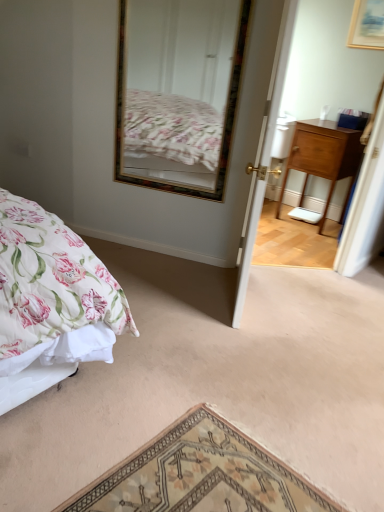
The width and height of the screenshot is (384, 512). What do you see at coordinates (264, 156) in the screenshot?
I see `white wooden door at center` at bounding box center [264, 156].

Image resolution: width=384 pixels, height=512 pixels. I want to click on white wooden door at center, so click(264, 156).

What is the approximate height of wooden-framed mirror at upper center?

It is 1.09 meters.

Locate an element on the screen. The height and width of the screenshot is (512, 384). wooden picture frame at upper right is located at coordinates (367, 25).

Find the location of a particular element. The height and width of the screenshot is (512, 384). white wooden door at center is located at coordinates (264, 156).

Who is taller, wooden nightstand at right or wooden-framed mirror at upper center?

wooden-framed mirror at upper center is taller.

Is point (349, 187) positioned behind point (180, 70)?

Yes, it is behind point (180, 70).

Is wooden nightstand at right wider or thinner than wooden-framed mirror at upper center?

wooden nightstand at right is wider than wooden-framed mirror at upper center.

From a real-world perspective, which is physically above, wooden nightstand at right or wooden-framed mirror at upper center?

From a 3D spatial view, wooden-framed mirror at upper center is above.

Which is closer to the camera, (360, 6) or (218, 78)?

Point (360, 6) is farther from the camera than point (218, 78).

From the picture: From the image's perspective, is wooden picture frame at upper right above or below wooden-framed mirror at upper center?

wooden picture frame at upper right is situated higher than wooden-framed mirror at upper center in the image.

How different are the orientations of wooden picture frame at upper right and wooden-framed mirror at upper center in degrees?

The angle between the facing direction of wooden picture frame at upper right and the facing direction of wooden-framed mirror at upper center is 26.6 degrees.

You are a GUI agent. You are given a task and a screenshot of the screen. Output one action in this format:
    pyautogui.click(x=<x>, y=<y>)
    Task: Click on the mirror that appears below the wooden picture frame at upper right (from the image's perspective)
    Image resolution: width=384 pixels, height=512 pixels.
    Given the screenshot: What is the action you would take?
    pyautogui.click(x=178, y=92)

From the image's perspective, which is above, wooden-framed mirror at upper center or wooden nightstand at right?

wooden-framed mirror at upper center, from the image's perspective.

Is there a large distance between wooden-framed mirror at upper center and wooden nightstand at right?

Actually, wooden-framed mirror at upper center and wooden nightstand at right are a little close together.

Between wooden-framed mirror at upper center and wooden nightstand at right, which one has less height?

With less height is wooden nightstand at right.

From a real-world perspective, is wooden-framed mirror at upper center physically located above or below white wooden door at center?

wooden-framed mirror at upper center is situated higher than white wooden door at center in the real world.

Is wooden-framed mirror at upper center facing away from white wooden door at center?

No.

From the image's perspective, does wooden-framed mirror at upper center appear lower than white wooden door at center?

Actually, wooden-framed mirror at upper center appears above white wooden door at center in the image.

Is wooden-framed mirror at upper center not near white wooden door at center?

Yes, wooden-framed mirror at upper center is far from white wooden door at center.

Is wooden picture frame at upper right at the left side of wooden nightstand at right?

No, wooden picture frame at upper right is not to the left of wooden nightstand at right.

Is wooden picture frame at upper right placed right next to wooden nightstand at right?

wooden picture frame at upper right and wooden nightstand at right are not in contact.

Identify the location of nightstand below the wooden picture frame at upper right (from a real-world perspective). The width and height of the screenshot is (384, 512). (323, 159).

Is white wooden door at center positioned behind wooden-framed mirror at upper center?

No, it is in front of wooden-framed mirror at upper center.

Is wooden-framed mirror at upper center at the back of white wooden door at center?

Absolutely, white wooden door at center is directed away from wooden-framed mirror at upper center.

Does white wooden door at center have a smaller size compared to wooden-framed mirror at upper center?

No.

How many degrees apart are the facing directions of white wooden door at center and wooden-framed mirror at upper center?

There is a 94.4-degree angle between the facing directions of white wooden door at center and wooden-framed mirror at upper center.

Do you think wooden-framed mirror at upper center is within wooden picture frame at upper right, or outside of it?

wooden-framed mirror at upper center exists outside the volume of wooden picture frame at upper right.

Considering the relative sizes of wooden-framed mirror at upper center and wooden picture frame at upper right in the image provided, is wooden-framed mirror at upper center taller than wooden picture frame at upper right?

Indeed, wooden-framed mirror at upper center has a greater height compared to wooden picture frame at upper right.

Relative to wooden picture frame at upper right, is wooden-framed mirror at upper center in front or behind?

In the image, wooden-framed mirror at upper center appears in front of wooden picture frame at upper right.

Where is `nightstand to the right of wooden-framed mirror at upper center`? The image size is (384, 512). nightstand to the right of wooden-framed mirror at upper center is located at coordinates (323, 159).

This screenshot has width=384, height=512. Find the location of `mirror that appears below the wooden picture frame at upper right (from the image's perspective)`. mirror that appears below the wooden picture frame at upper right (from the image's perspective) is located at coordinates (178, 92).

From the image, which object appears to be farther from wooden nightstand at right, wooden picture frame at upper right or white wooden door at center?

Based on the image, white wooden door at center appears to be further to wooden nightstand at right.

Estimate the real-world distances between objects in this image. Which object is further from white wooden door at center, wooden nightstand at right or wooden picture frame at upper right?

Based on the image, wooden picture frame at upper right appears to be further to white wooden door at center.

From the picture: From the image, which object appears to be farther from wooden picture frame at upper right, wooden nightstand at right or white wooden door at center?

white wooden door at center.

Estimate the real-world distances between objects in this image. Which object is closer to wooden nightstand at right, white wooden door at center or wooden-framed mirror at upper center?

wooden-framed mirror at upper center.

From the image, which object appears to be farther from wooden nightstand at right, wooden-framed mirror at upper center or white wooden door at center?

white wooden door at center lies further to wooden nightstand at right than the other object.

Which object lies further to the anchor point wooden picture frame at upper right, white wooden door at center or wooden-framed mirror at upper center?

Among the two, white wooden door at center is located further to wooden picture frame at upper right.

From the image, which object appears to be nearer to wooden-framed mirror at upper center, wooden nightstand at right or white wooden door at center?

Among the two, wooden nightstand at right is located nearer to wooden-framed mirror at upper center.

Consider the image. From the image, which object appears to be farther from wooden-framed mirror at upper center, white wooden door at center or wooden picture frame at upper right?

white wooden door at center lies further to wooden-framed mirror at upper center than the other object.

This screenshot has width=384, height=512. Find the location of `nightstand between wooden-framed mirror at upper center and wooden picture frame at upper right from left to right`. nightstand between wooden-framed mirror at upper center and wooden picture frame at upper right from left to right is located at coordinates (323, 159).

Where is `picture frame positioned between white wooden door at center and wooden nightstand at right from near to far`? This screenshot has width=384, height=512. picture frame positioned between white wooden door at center and wooden nightstand at right from near to far is located at coordinates (367, 25).

Find the location of `mirror between white wooden door at center and wooden picture frame at upper right in the front-back direction`. mirror between white wooden door at center and wooden picture frame at upper right in the front-back direction is located at coordinates (178, 92).

Where is `mirror positioned between white wooden door at center and wooden nightstand at right from near to far`? The height and width of the screenshot is (512, 384). mirror positioned between white wooden door at center and wooden nightstand at right from near to far is located at coordinates (178, 92).